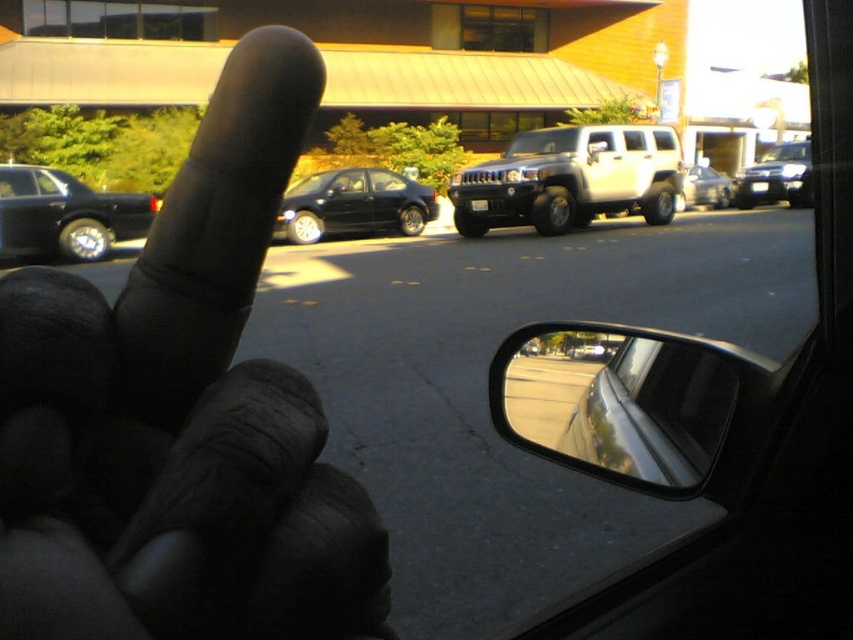
Is matte black sedan at center to the left of metallic silver suv at upper right from the viewer's perspective?

Correct, you'll find matte black sedan at center to the left of metallic silver suv at upper right.

Based on the photo, does matte black sedan at center lie in front of metallic silver suv at upper right?

Yes.

Who is more forward, (x=422, y=216) or (x=735, y=180)?

Point (x=422, y=216) is in front.

Locate an element on the screen. This screenshot has width=853, height=640. matte black sedan at center is located at coordinates (352, 204).

Between shiny black sedan at left and metallic silver suv at upper right, which one has more height?

metallic silver suv at upper right

Is point (10, 164) positioned behind point (746, 177)?

No.

I want to click on shiny black sedan at left, so click(65, 214).

Which is more to the left, black matte finger at upper left or metallic silver suv at center?

black matte finger at upper left

Measure the distance from black matte finger at upper left to metallic silver suv at center.

black matte finger at upper left is 63.49 feet from metallic silver suv at center.

Which is in front, point (223, 456) or point (695, 180)?

Point (223, 456) is more forward.

The height and width of the screenshot is (640, 853). In order to click on black matte finger at upper left in this screenshot , I will do `click(183, 417)`.